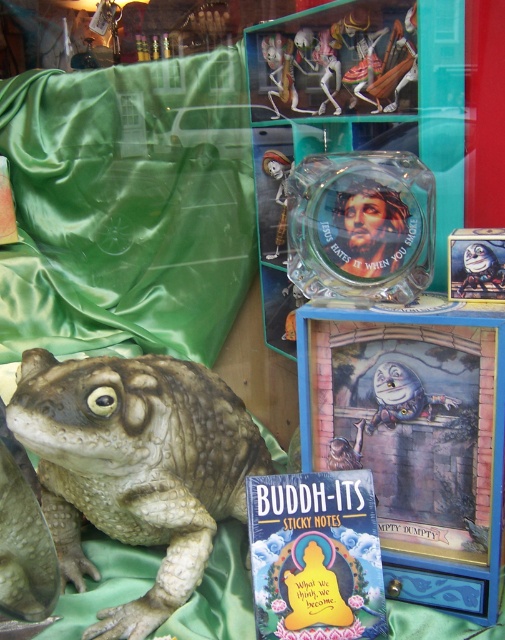
Question: Is leather-like brown frog at lower left thinner than green rubber frog at lower left?

Choices:
 (A) yes
 (B) no

Answer: (B)

Question: Which point is farther to the camera?

Choices:
 (A) (97, 358)
 (B) (376, 419)

Answer: (A)

Question: Is leather-like brown frog at lower left bigger than green rubber frog at lower left?

Choices:
 (A) yes
 (B) no

Answer: (A)

Question: Which of the following is the farthest from the observer?

Choices:
 (A) leather-like brown frog at lower left
 (B) green rubber frog at lower left

Answer: (B)

Question: Is leather-like brown frog at lower left to the right of green rubber frog at lower left from the viewer's perspective?

Choices:
 (A) yes
 (B) no

Answer: (B)